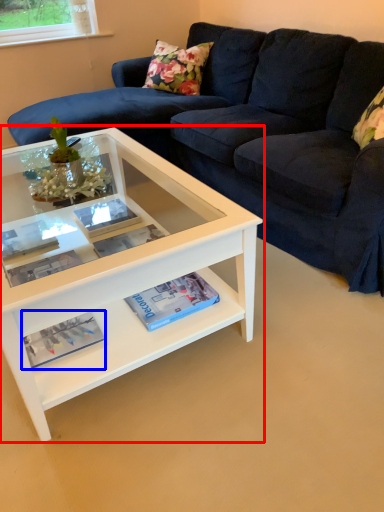
Question: Among these objects, which one is farthest to the camera, coffee table (highlighted by a red box) or magazine (highlighted by a blue box)?

Choices:
 (A) coffee table
 (B) magazine

Answer: (B)